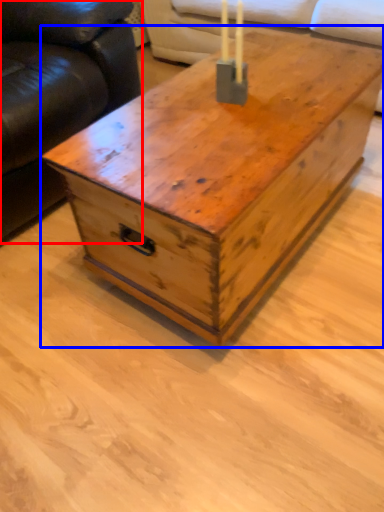
Question: Which of the following is the closest to the observer, studio couch (highlighted by a red box) or table (highlighted by a blue box)?

Choices:
 (A) studio couch
 (B) table

Answer: (B)